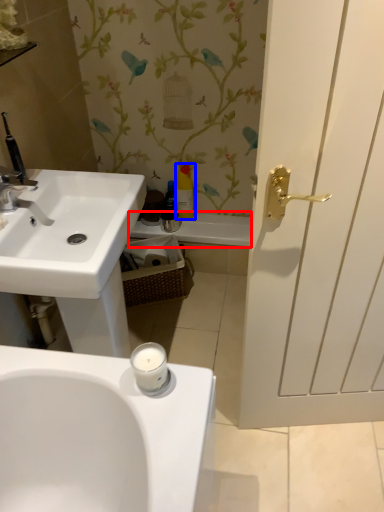
Question: Among these objects, which one is farthest to the camera, bath (highlighted by a red box) or toiletry (highlighted by a blue box)?

Choices:
 (A) bath
 (B) toiletry

Answer: (A)